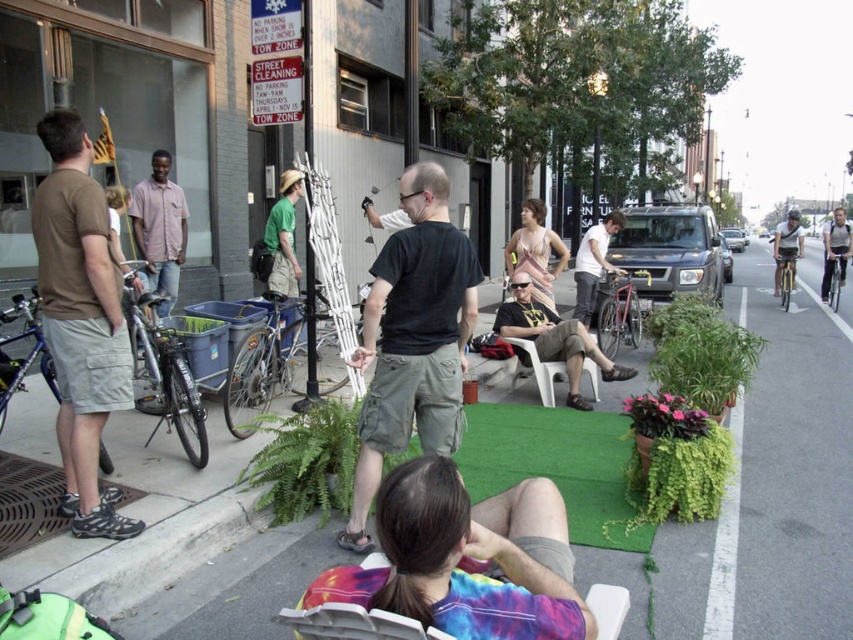
Between brown cotton t-shirt at left and matte black t-shirt at center, which one is positioned lower?

matte black t-shirt at center is lower down.

Who is more distant from viewer, (64, 280) or (512, 312)?

Positioned behind is point (512, 312).

Between point (39, 129) and point (518, 285), which one is positioned in front?

Point (39, 129) is more forward.

Identify the location of brown cotton t-shirt at left. (80, 321).

Measure the distance between black cotton shirt at center and light blue shirt at right.

black cotton shirt at center and light blue shirt at right are 14.98 meters apart from each other.

Is black cotton shirt at center taller than light blue shirt at right?

No.

Locate an element on the screen. This screenshot has height=640, width=853. black cotton shirt at center is located at coordinates (413, 339).

Find the location of `black cotton shirt at center`. black cotton shirt at center is located at coordinates pyautogui.click(x=413, y=339).

Does pink shirt at center come in front of light blue jeans at right?

Yes.

Which is in front, point (160, 164) or point (784, 262)?

Positioned in front is point (160, 164).

Where is `pink shirt at center`? This screenshot has width=853, height=640. pink shirt at center is located at coordinates (160, 228).